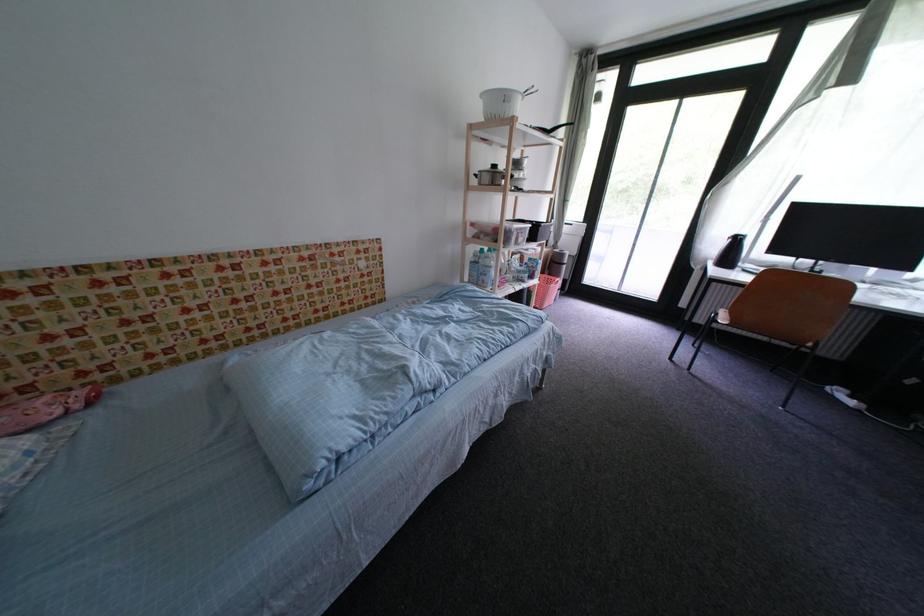
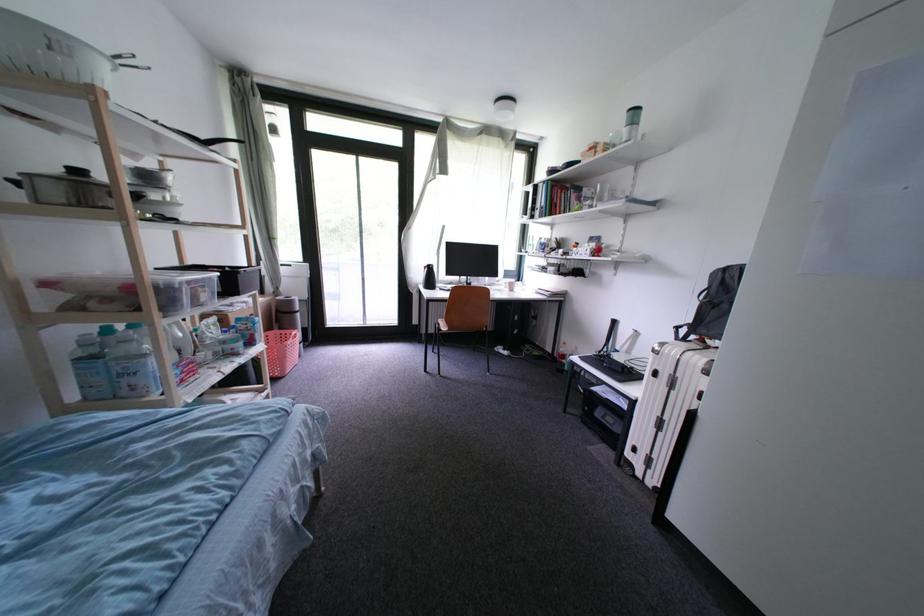
Question: The camera is either moving clockwise (left) or counter-clockwise (right) around the object. The first image is from the beginning of the video and the second image is from the end. Is the camera moving left or right when shooting the video?

Choices:
 (A) Left
 (B) Right

Answer: (A)